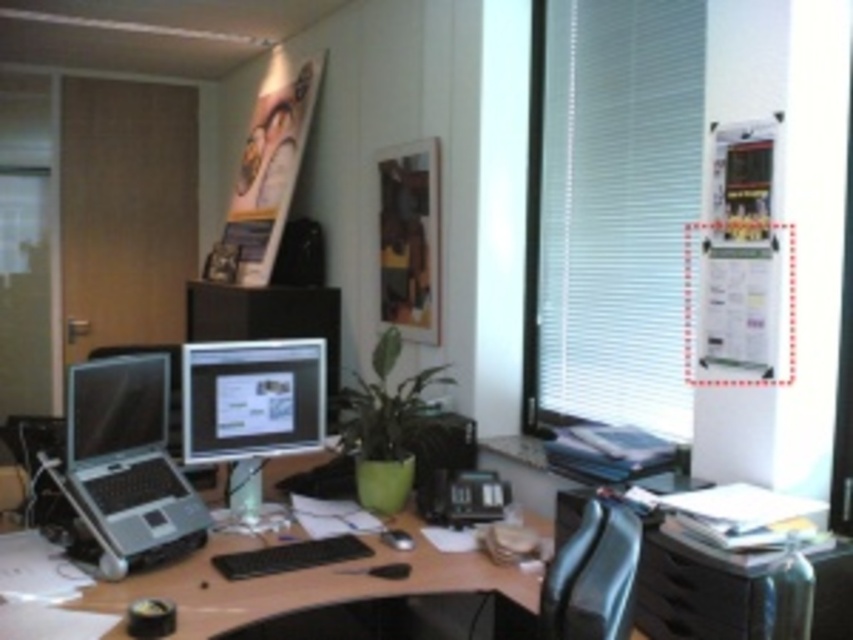
Question: Estimate the real-world distances between objects in this image. Which object is closer to the matte black laptop at left?

Choices:
 (A) matte black monitor at left
 (B) matte black monitor at center
 (C) matte black desk at center

Answer: (A)

Question: Is matte black laptop at left further to camera compared to matte black desk at center?

Choices:
 (A) no
 (B) yes

Answer: (B)

Question: Is white matte blinds at right to the left of matte black monitor at left from the viewer's perspective?

Choices:
 (A) no
 (B) yes

Answer: (A)

Question: Which is farther from the matte black monitor at left?

Choices:
 (A) matte black monitor at center
 (B) matte black desk at center
 (C) matte black laptop at left

Answer: (B)

Question: Is matte black laptop at left smaller than matte black monitor at center?

Choices:
 (A) no
 (B) yes

Answer: (A)

Question: Among these objects, which one is farthest from the camera?

Choices:
 (A) matte black monitor at left
 (B) white matte blinds at right
 (C) matte black monitor at center

Answer: (C)